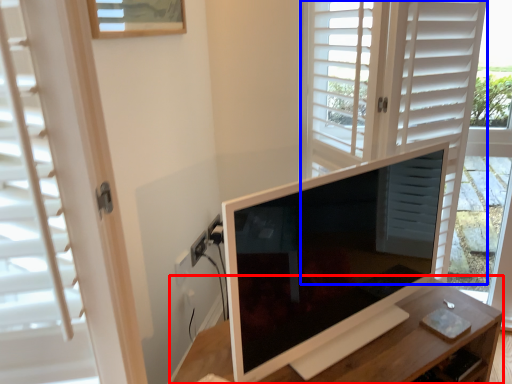
Question: Which object is further to the camera taking this photo, table (highlighted by a red box) or screen door (highlighted by a blue box)?

Choices:
 (A) table
 (B) screen door

Answer: (B)